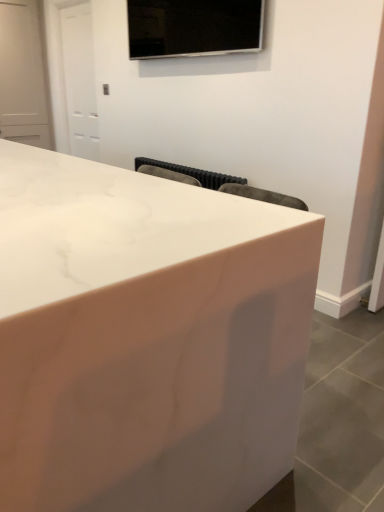
Question: Do you think white marble countertop at center is within black glossy tv at upper center, or outside of it?

Choices:
 (A) outside
 (B) inside

Answer: (A)

Question: Considering the positions of white marble countertop at center and black glossy tv at upper center in the image, is white marble countertop at center bigger or smaller than black glossy tv at upper center?

Choices:
 (A) big
 (B) small

Answer: (A)

Question: Considering the positions of white marble countertop at center and black glossy tv at upper center in the image, is white marble countertop at center taller or shorter than black glossy tv at upper center?

Choices:
 (A) tall
 (B) short

Answer: (A)

Question: In the image, is black glossy tv at upper center positioned in front of or behind white marble countertop at center?

Choices:
 (A) front
 (B) behind

Answer: (B)

Question: Looking at their shapes, would you say black glossy tv at upper center is wider or thinner than white marble countertop at center?

Choices:
 (A) thin
 (B) wide

Answer: (A)

Question: From the image's perspective, is black glossy tv at upper center positioned above or below white marble countertop at center?

Choices:
 (A) below
 (B) above

Answer: (B)

Question: Based on their sizes in the image, would you say black glossy tv at upper center is bigger or smaller than white marble countertop at center?

Choices:
 (A) small
 (B) big

Answer: (A)